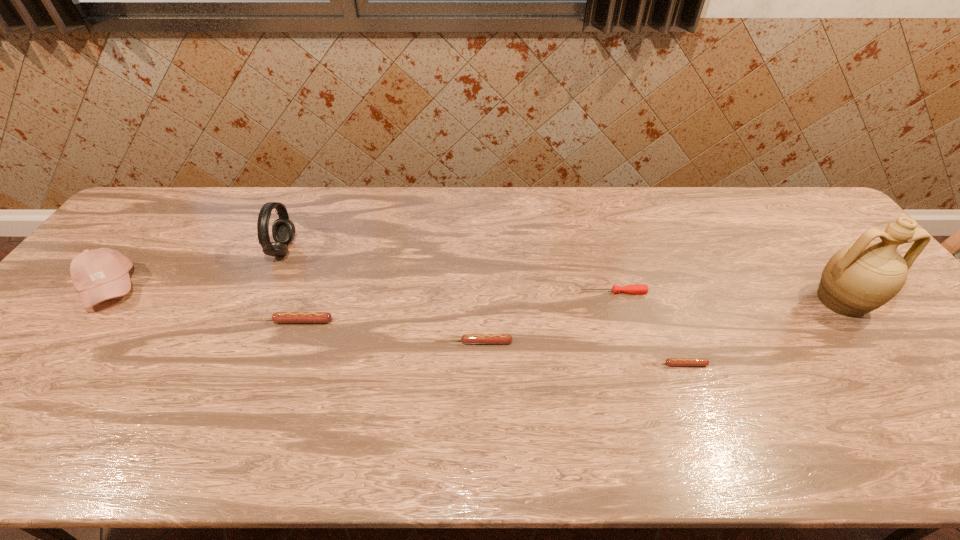
Select which sausage appears as the closest to the tallest object. Please provide its 2D coordinates. Your answer should be formatted as a tuple, i.e. [(x, y)], where the tuple contains the x and y coordinates of a point satisfying the conditions above.

[(669, 361)]

Where is `vacant position in the image that satisfies the following two spatial constraints: 1. on the front-facing side of the fourth shortest object; 2. on the left side of the third tallest object`? vacant position in the image that satisfies the following two spatial constraints: 1. on the front-facing side of the fourth shortest object; 2. on the left side of the third tallest object is located at coordinates (84, 321).

Locate an element on the screen. Image resolution: width=960 pixels, height=540 pixels. vacant point that satisfies the following two spatial constraints: 1. on the earcups of the rightmost object; 2. on the right side of the second tallest object is located at coordinates (260, 301).

Find the location of `blank area in the image that satisfies the following two spatial constraints: 1. on the front side of the leftmost sausage; 2. on the left side of the nearest sausage`. blank area in the image that satisfies the following two spatial constraints: 1. on the front side of the leftmost sausage; 2. on the left side of the nearest sausage is located at coordinates (273, 364).

The image size is (960, 540). Identify the location of blank space that satisfies the following two spatial constraints: 1. on the back side of the second tallest sausage; 2. on the earcups of the headset. (475, 249).

Identify the location of free point that satisfies the following two spatial constraints: 1. on the back side of the nearest sausage; 2. on the front-facing side of the leftmost object. (648, 288).

At what (x,y) coordinates should I click in order to perform the action: click on free point that satisfies the following two spatial constraints: 1. on the back side of the farthest sausage; 2. on the earcups of the headset. Please return your answer as a coordinate pair (x, y). This screenshot has width=960, height=540. Looking at the image, I should click on (316, 249).